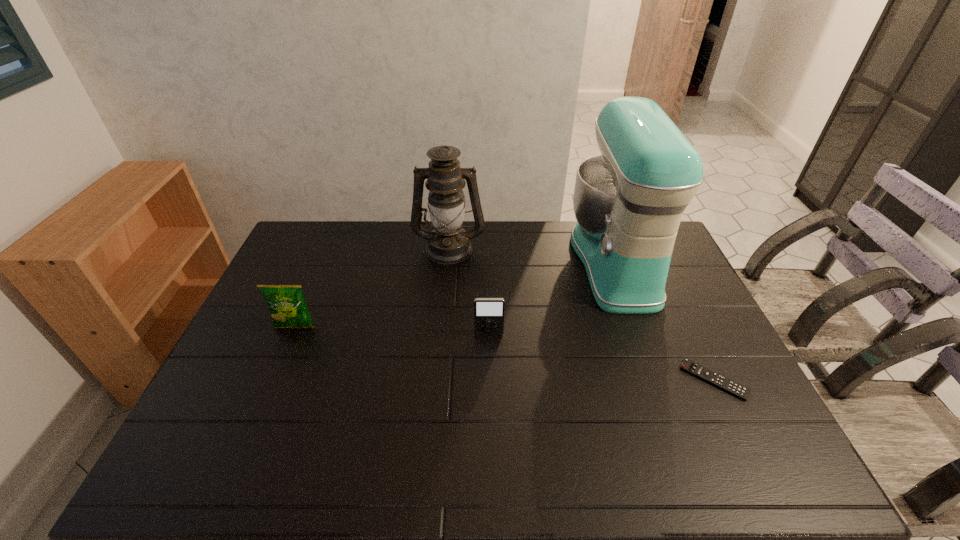
You are a GUI agent. You are given a task and a screenshot of the screen. Output one action in this format:
    pyautogui.click(x=<x>, y=<y>)
    Task: Click on the blank area in the image that satisfies the following two spatial constraints: 1. on the front-facing side of the shortest object; 2. on the right side of the fourth tallest object
    The width and height of the screenshot is (960, 540).
    Given the screenshot: What is the action you would take?
    pyautogui.click(x=490, y=380)